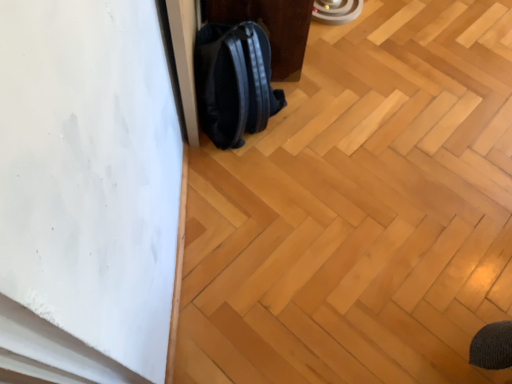
Question: In terms of width, does black leather backpack at lower left look wider or thinner when compared to natural wood floor at center?

Choices:
 (A) thin
 (B) wide

Answer: (A)

Question: Choose the correct answer: Is black leather backpack at lower left inside natural wood floor at center or outside it?

Choices:
 (A) inside
 (B) outside

Answer: (B)

Question: Based on their relative distances, which object is nearer to the black leather backpack at lower left?

Choices:
 (A) black matte backpack at center
 (B) natural wood floor at center

Answer: (A)

Question: Considering the real-world distances, which object is closest to the black leather backpack at lower left?

Choices:
 (A) natural wood floor at center
 (B) black matte backpack at center

Answer: (B)